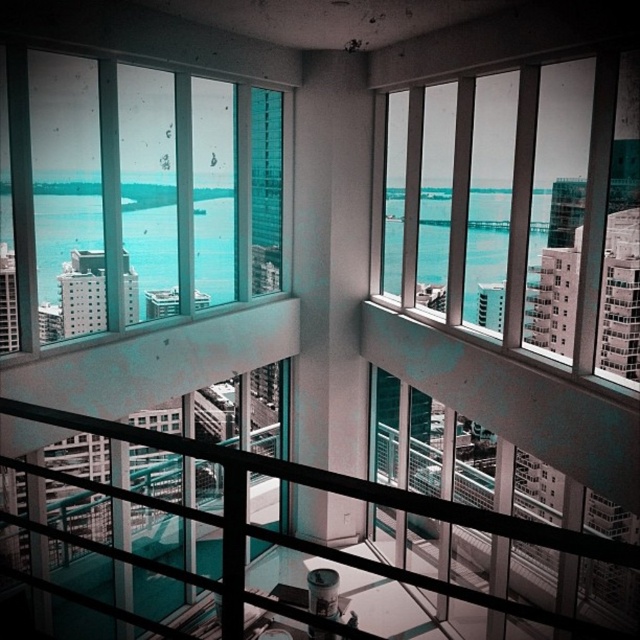
From the picture: Is clear glass windows at upper right above black metal railing at center?

Indeed, clear glass windows at upper right is positioned over black metal railing at center.

Between clear glass windows at upper right and black metal railing at center, which one appears on the right side from the viewer's perspective?

From the viewer's perspective, clear glass windows at upper right appears more on the right side.

Is point (525, 336) positioned before point (544, 532)?

No, (525, 336) is further to viewer.

Locate an element on the screen. Image resolution: width=640 pixels, height=640 pixels. clear glass windows at upper right is located at coordinates (522, 211).

Identify the location of transparent glass window at upper left. The image size is (640, 640). (136, 195).

Is point (241, 172) farther from viewer compared to point (611, 259)?

That is True.

I want to click on transparent glass window at upper left, so click(x=136, y=195).

Is transparent glass window at upper left taller than black metal railing at center?

Indeed, transparent glass window at upper left has a greater height compared to black metal railing at center.

Between transparent glass window at upper left and black metal railing at center, which one appears on the left side from the viewer's perspective?

Positioned to the left is transparent glass window at upper left.

What do you see at coordinates (136, 195) in the screenshot? I see `transparent glass window at upper left` at bounding box center [136, 195].

This screenshot has height=640, width=640. I want to click on transparent glass window at upper left, so click(136, 195).